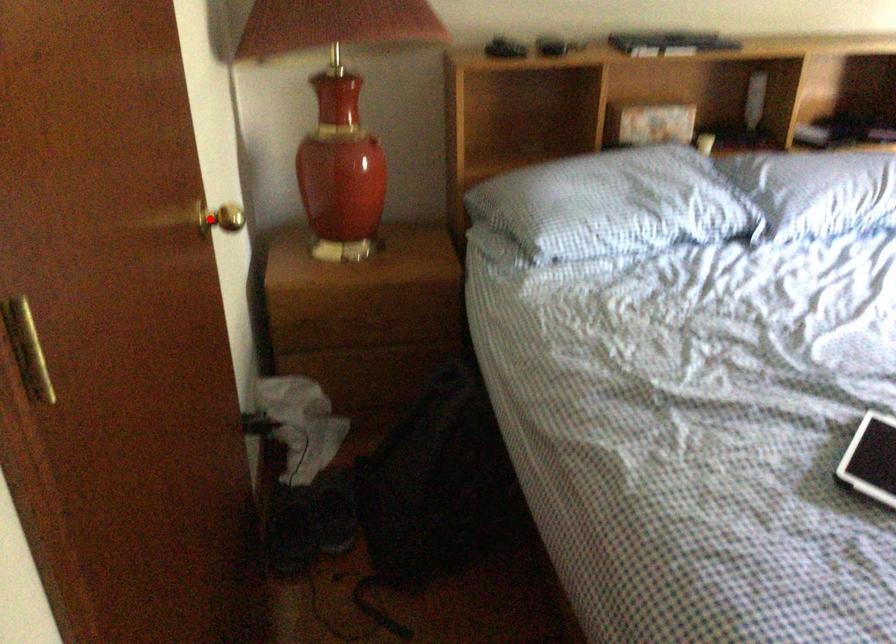
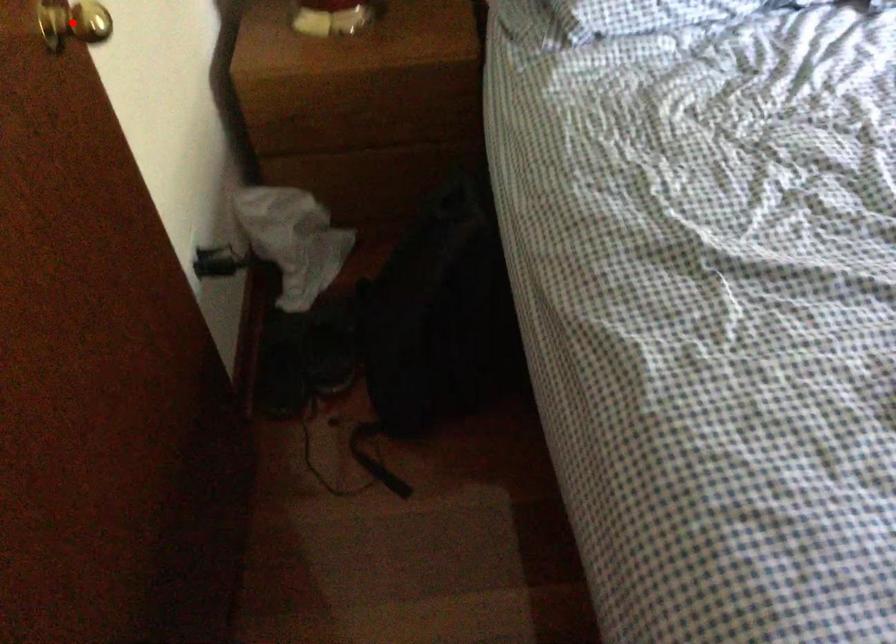
I am providing you with two images of the same scene from different viewpoints. A red point is marked on the first image and another point is marked on the second image. Is the red point in image1 aligned with the point shown in image2?

Yes